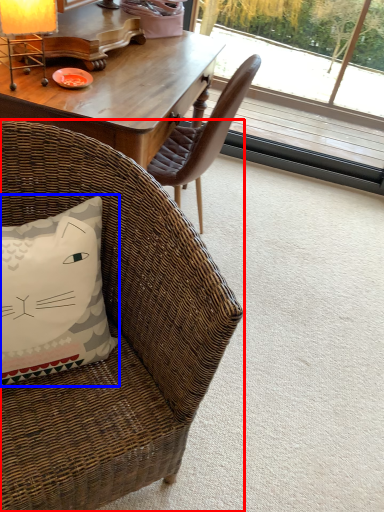
Question: Which point is further to the camera, chair (highlighted by a red box) or pillow (highlighted by a blue box)?

Choices:
 (A) chair
 (B) pillow

Answer: (B)